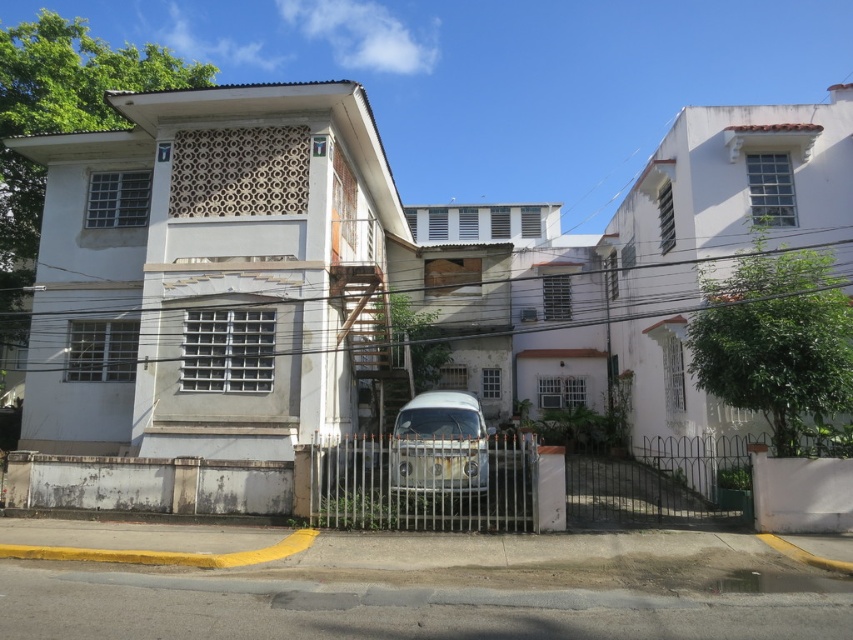
You are standing at the base of the staircase leading to the second floor of the building. You notice two points marked in the scene. The first point is at coordinates point (323,452) and the second is at point (450,484). Which point is closer to you as you face the building?

Point (450,484) is closer to you because the description states that point (323,452) is behind point (450,484), meaning the latter is in front.

You are a delivery driver arriving at this residential area. You need to park your truck, which is 3 meters wide, next to the white matte van at center. Can you safely park your truck next to the metallic gate at center without blocking the entrance?

The metallic gate at center is larger in size than the white matte van at center. Since the truck is 3 meters wide and the metallic gate at center is larger than the van, it should have enough space to park next to the gate without blocking the entrance.